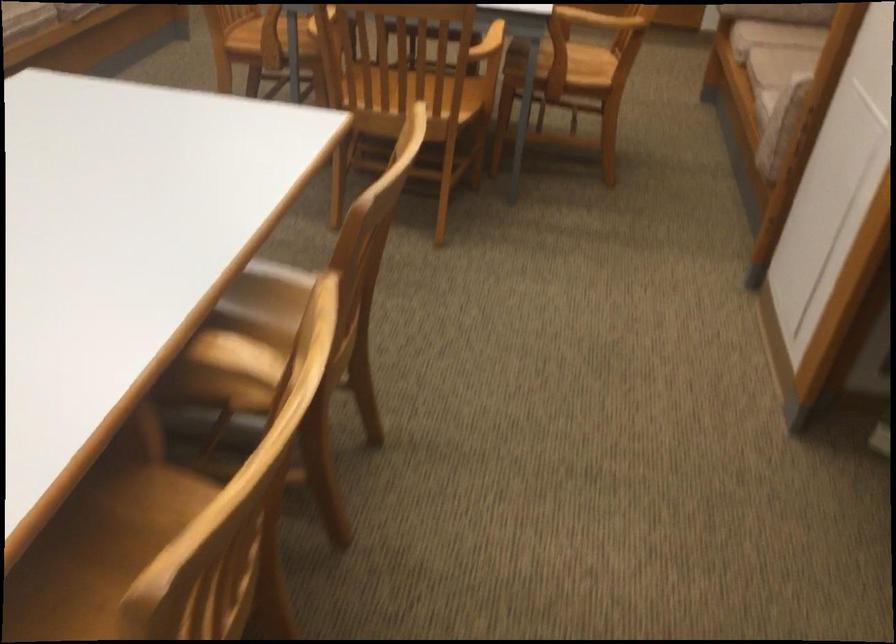
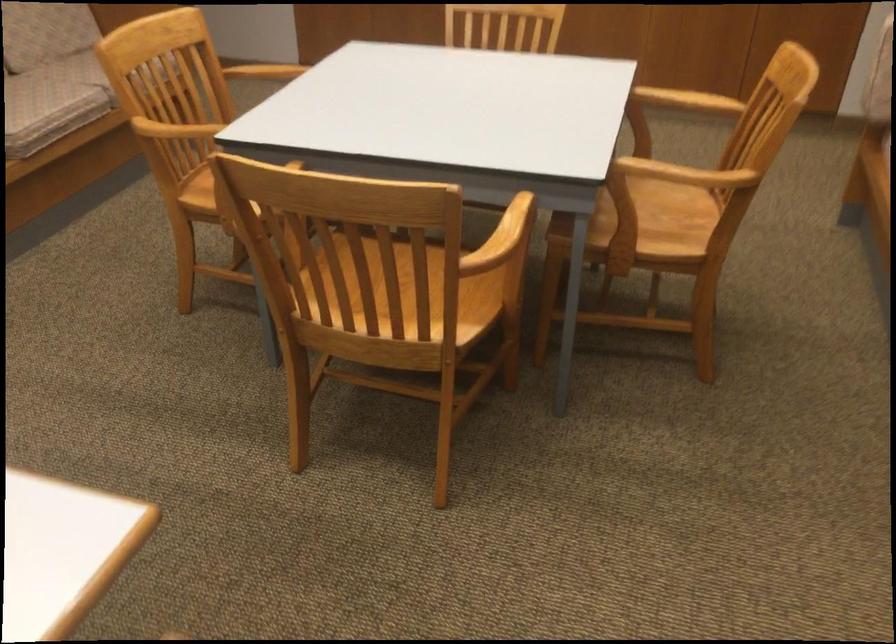
Question: What movement of the cameraman would produce the second image?

Choices:
 (A) Left
 (B) Right
 (C) Forward
 (D) Backward

Answer: (C)